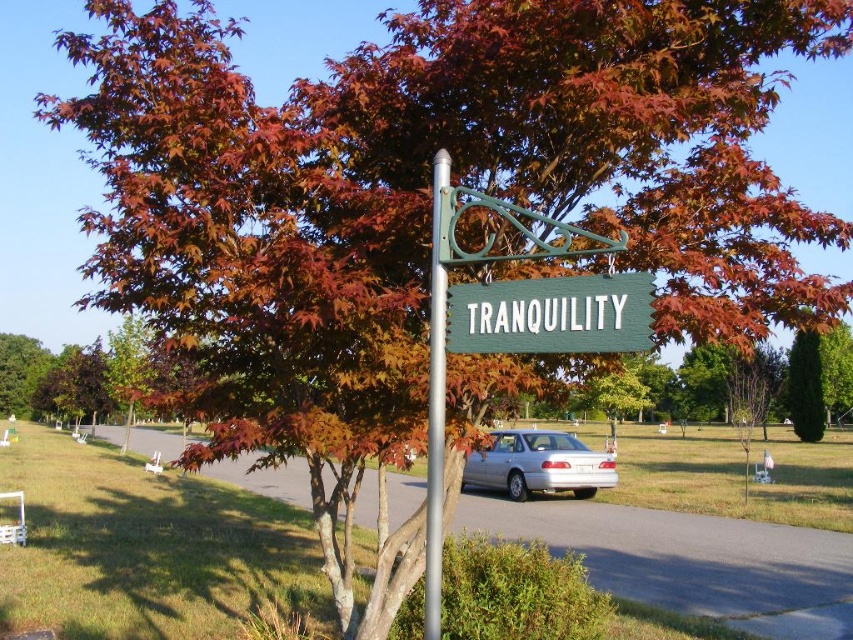
Identify the location of green wood sign at center. The height and width of the screenshot is (640, 853). (550, 314).

Can you confirm if green wood sign at center is smaller than green textured hedge at center?

Indeed, green wood sign at center has a smaller size compared to green textured hedge at center.

This screenshot has width=853, height=640. I want to click on green wood sign at center, so click(x=550, y=314).

The width and height of the screenshot is (853, 640). Find the location of `green wood sign at center`. green wood sign at center is located at coordinates (550, 314).

Which is above, green wooden sign at center or silver metallic sedan at center?

silver metallic sedan at center is higher up.

Does green wooden sign at center have a larger size compared to silver metallic sedan at center?

Indeed, green wooden sign at center has a larger size compared to silver metallic sedan at center.

Is point (167, 608) positioned before point (486, 484)?

Yes, point (167, 608) is in front of point (486, 484).

You are a GUI agent. You are given a task and a screenshot of the screen. Output one action in this format:
    pyautogui.click(x=<x>, y=<y>)
    Task: Click on the green wooden sign at center
    This screenshot has height=640, width=853.
    Given the screenshot: What is the action you would take?
    pyautogui.click(x=692, y=561)

Between green wood sign at center and silver metallic pole at center, which one has more height?

silver metallic pole at center

The image size is (853, 640). What do you see at coordinates (550, 314) in the screenshot?
I see `green wood sign at center` at bounding box center [550, 314].

Does point (614, 305) come farther from viewer compared to point (437, 323)?

No, it is in front of (437, 323).

Where is `green wood sign at center`? The image size is (853, 640). green wood sign at center is located at coordinates (550, 314).